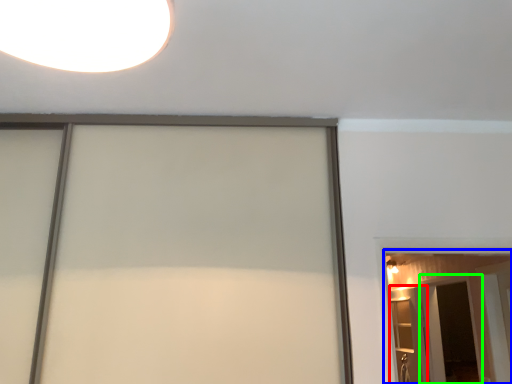
Question: Which object is the closest to the elevator (highlighted by a red box)? Choose among these: barn door (highlighted by a blue box) or screen door (highlighted by a green box).

Choices:
 (A) barn door
 (B) screen door

Answer: (B)